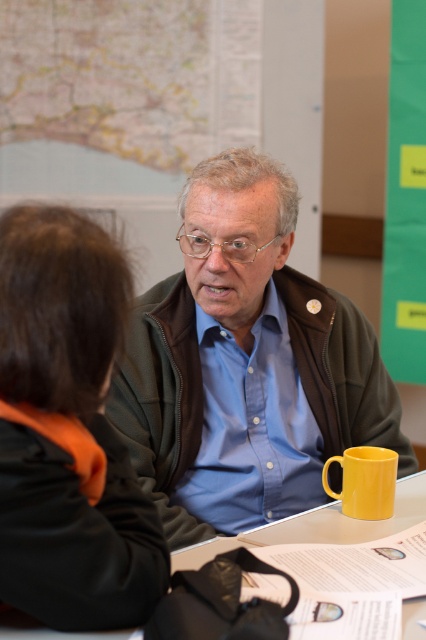
Based on the photo, can you confirm if matte brown jacket at center is smaller than yellow matte mug at lower right?

No.

Is point (141, 324) closer to viewer compared to point (347, 451)?

No, (141, 324) is behind (347, 451).

Identify the location of matte brown jacket at center. (244, 364).

Who is more forward, [210,376] or [20,520]?

Point [20,520] is more forward.

Can you confirm if matte brown jacket at center is positioned to the right of black fabric jacket at lower left?

Yes, matte brown jacket at center is to the right of black fabric jacket at lower left.

Is point (244, 180) closer to viewer compared to point (131, 472)?

No, (244, 180) is further to viewer.

I want to click on matte brown jacket at center, so click(x=244, y=364).

Which is below, yellow matte/metallic table at center or yellow matte mug at lower right?

Positioned lower is yellow matte/metallic table at center.

Is point (408, 616) positioned after point (353, 493)?

No.

You are a GUI agent. You are given a task and a screenshot of the screen. Output one action in this format:
    pyautogui.click(x=<x>, y=<y>)
    Task: Click on the yellow matte/metallic table at center
    
    Given the screenshot: What is the action you would take?
    pyautogui.click(x=319, y=525)